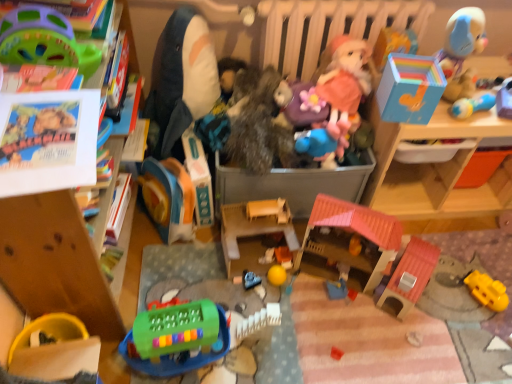
Locate an element on the screen. This screenshot has height=384, width=512. free region on the left part of wooden farm at center, which is counted as the 9th toy, starting from the right is located at coordinates (198, 267).